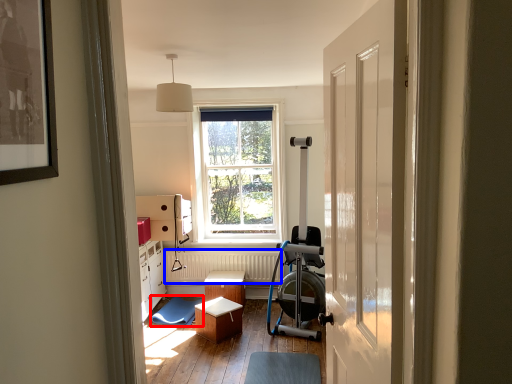
Question: Which of the following is the farthest to the observer, swivel chair (highlighted by a red box) or radiator (highlighted by a blue box)?

Choices:
 (A) swivel chair
 (B) radiator

Answer: (B)